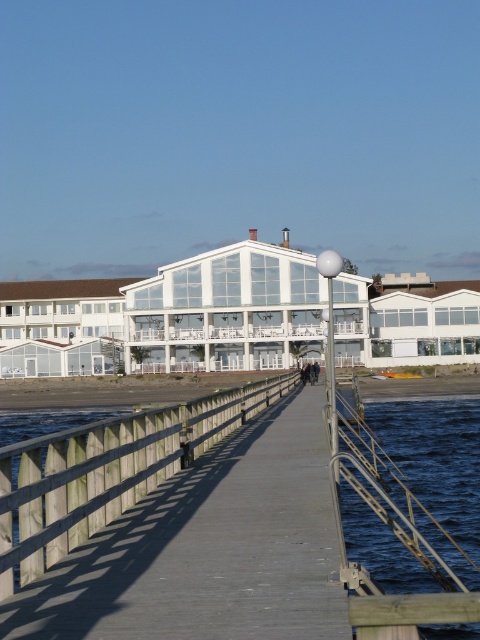
Question: Which point is closer to the camera taking this photo?

Choices:
 (A) (381, 433)
 (B) (300, 371)

Answer: (A)

Question: Is wooden at center further to camera compared to dark blue jeans at center?

Choices:
 (A) yes
 (B) no

Answer: (B)

Question: Which object appears closest to the camera in this image?

Choices:
 (A) wooden at center
 (B) blue water at lower right
 (C) dark blue jeans at center

Answer: (A)

Question: Is wooden at center to the right of dark blue jeans at center from the viewer's perspective?

Choices:
 (A) no
 (B) yes

Answer: (A)

Question: In this image, where is wooden at center located relative to blue water at lower right?

Choices:
 (A) above
 (B) below

Answer: (A)

Question: Which is nearer to the wooden at center?

Choices:
 (A) blue water at lower right
 (B) dark blue jeans at center

Answer: (A)